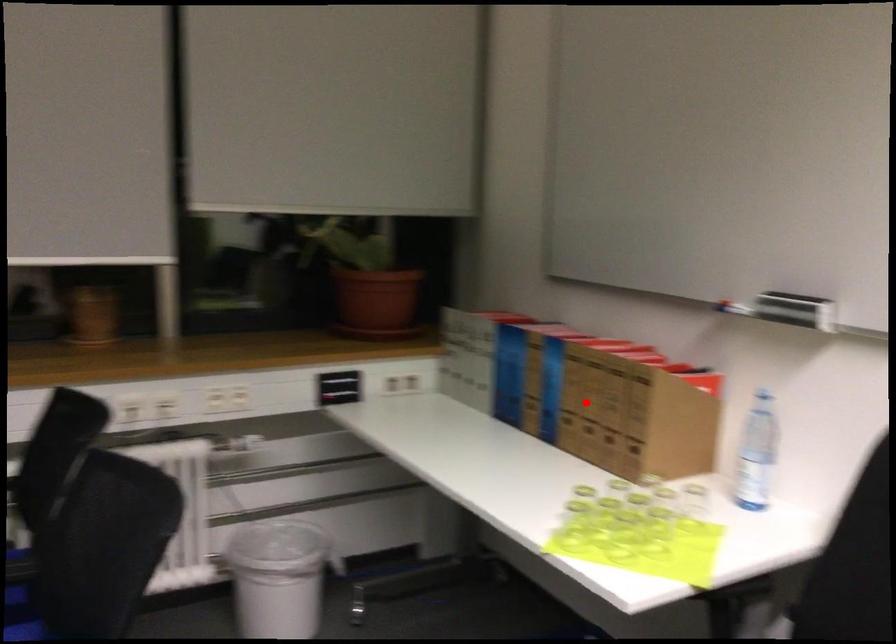
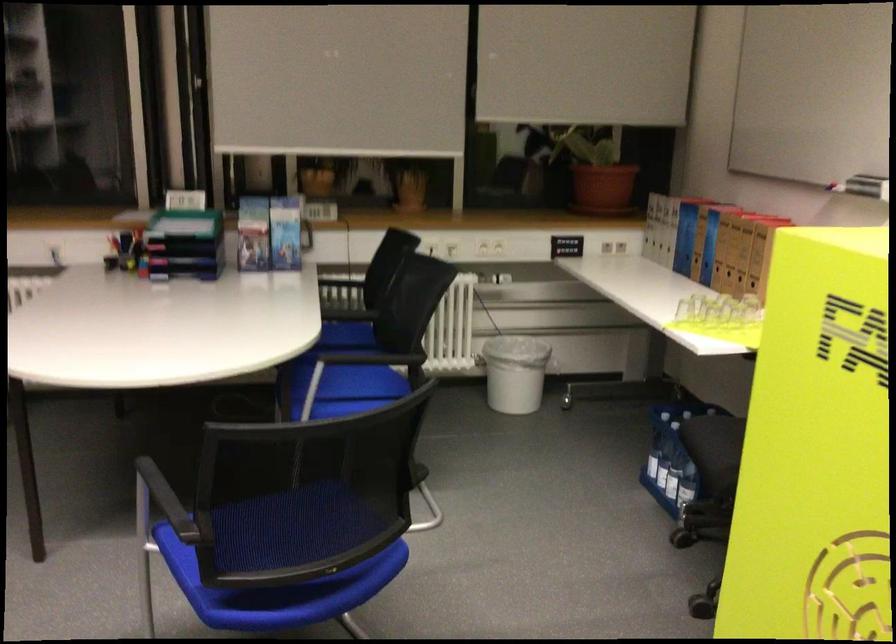
Question: I am providing you with two images of the same scene from different viewpoints. In image1, a red point is highlighted. Considering the same 3D point in image2, which of the following is correct?

Choices:
 (A) It is closer
 (B) It is farther

Answer: (B)